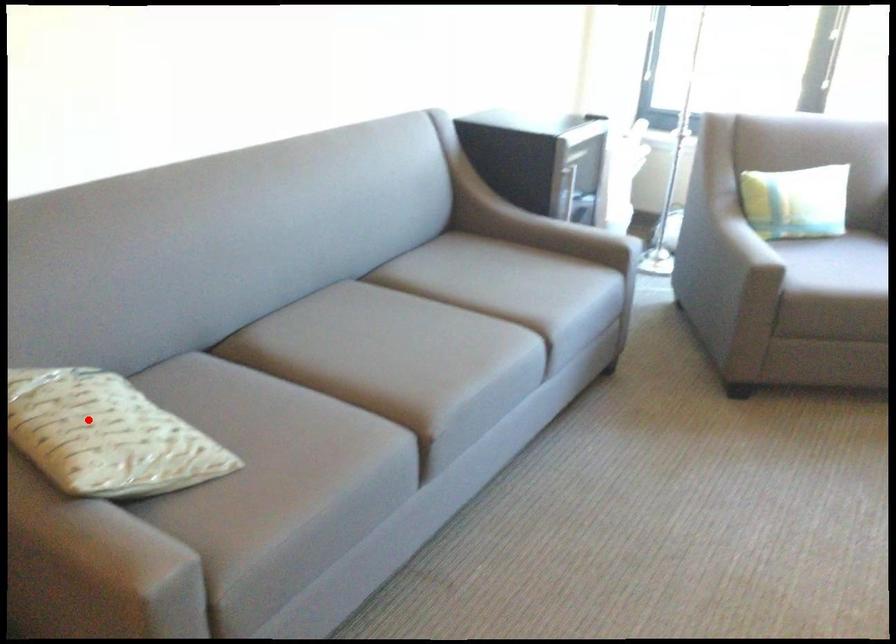
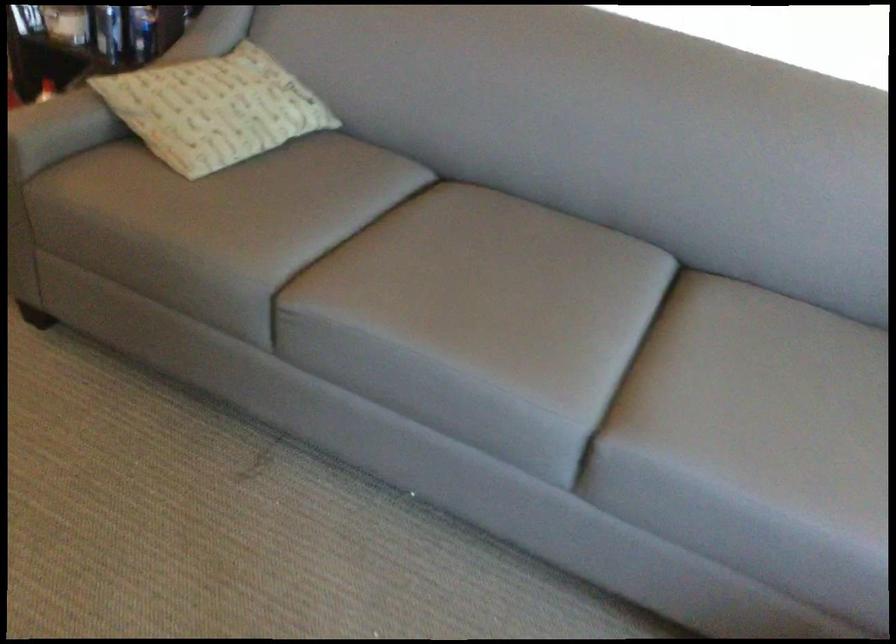
Question: I am providing you with two images of the same scene from different viewpoints. A red point is shown in image1. For the corresponding object point in image2, is it positioned nearer or farther from the camera?

Choices:
 (A) Nearer
 (B) Farther

Answer: (B)